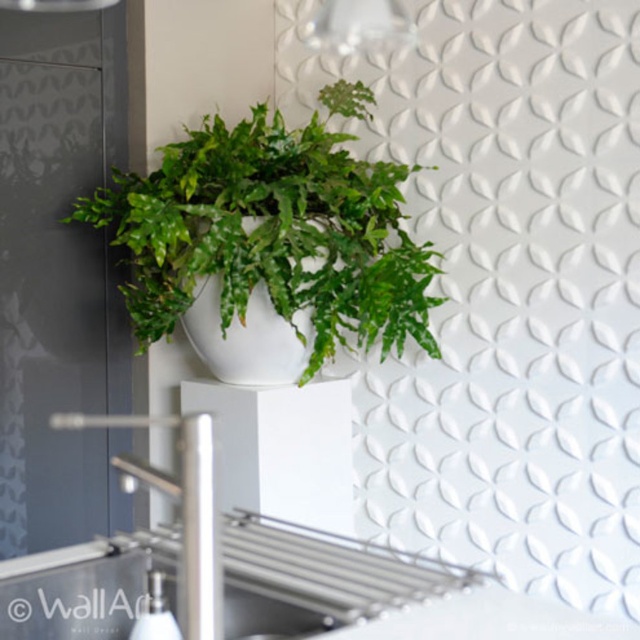
You are standing in a modern bathroom and see a white shelf with a plant. There is a point marked at coordinates (273,230). Which object is this point located on?

The point at coordinates (273,230) is located on the green matte plant at upper center.

You are a home decorator planning to place a new decorative item between the green matte plant at upper center and the silver metallic faucet at center. Which object should you place the item closer to if you want it to appear proportionally balanced with both?

Since the green matte plant at upper center is larger than the silver metallic faucet at center, you should place the new decorative item closer to the silver metallic faucet at center to achieve a balanced appearance.